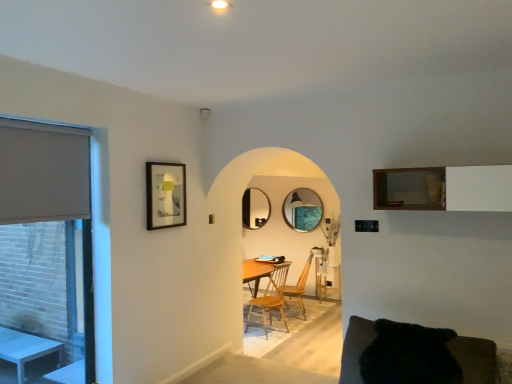
What do you see at coordinates (165, 195) in the screenshot?
I see `wooden framed artwork at upper left` at bounding box center [165, 195].

Based on the photo, measure the distance between matte glass mirror at center, which is the first mirror from front to back, and camera.

A distance of 6.65 meters exists between matte glass mirror at center, which is the first mirror from front to back, and camera.

What do you see at coordinates (255, 208) in the screenshot?
I see `matte black mirror at center, marked as the 1th mirror in a left-to-right arrangement` at bounding box center [255, 208].

This screenshot has height=384, width=512. Describe the element at coordinates (298, 287) in the screenshot. I see `wooden chair at center, the first chair positioned from the back` at that location.

Describe the element at coordinates (45, 252) in the screenshot. I see `beige fabric window at left` at that location.

The image size is (512, 384). I want to click on wooden frame at upper right, so click(444, 188).

Can you confirm if matte black mirror at center, arranged as the 2th mirror when viewed from the front, is positioned to the left of matte glass mirror at center, placed as the 2th mirror when sorted from back to front?

Yes, matte black mirror at center, arranged as the 2th mirror when viewed from the front, is to the left of matte glass mirror at center, placed as the 2th mirror when sorted from back to front.

Are matte black mirror at center, the second mirror when ordered from right to left, and matte glass mirror at center, placed as the 2th mirror when sorted from back to front, located far from each other?

matte black mirror at center, the second mirror when ordered from right to left, is near matte glass mirror at center, placed as the 2th mirror when sorted from back to front, not far away.

From the image's perspective, is matte black mirror at center, which ranks as the first mirror in back-to-front order, over matte glass mirror at center, marked as the 1th mirror in a right-to-left arrangement?

Indeed, from the image's perspective, matte black mirror at center, which ranks as the first mirror in back-to-front order, is shown above matte glass mirror at center, marked as the 1th mirror in a right-to-left arrangement.

In the scene shown: Choose the correct answer: Is matte black mirror at center, marked as the 1th mirror in a left-to-right arrangement, inside matte glass mirror at center, which is the first mirror from front to back, or outside it?

matte black mirror at center, marked as the 1th mirror in a left-to-right arrangement, is located beyond the bounds of matte glass mirror at center, which is the first mirror from front to back.

Does matte gray roller blind at left touch matte glass mirror at center, placed as the 2th mirror when sorted from back to front?

No, matte gray roller blind at left is not with matte glass mirror at center, placed as the 2th mirror when sorted from back to front.

Can you confirm if matte gray roller blind at left is thinner than matte glass mirror at center, which is the first mirror from front to back?

Indeed, matte gray roller blind at left has a lesser width compared to matte glass mirror at center, which is the first mirror from front to back.

Based on the photo, from the image's perspective, which object appears higher, matte gray roller blind at left or matte glass mirror at center, which is the first mirror from front to back?

matte gray roller blind at left is shown above in the image.

From the image's perspective, which is below, wooden framed artwork at upper left or wooden frame at upper right?

From the image's view, wooden framed artwork at upper left is below.

From a real-world perspective, does wooden framed artwork at upper left stand above wooden frame at upper right?

No.

Does point (153, 206) come closer to viewer compared to point (407, 178)?

No.

Is wooden framed artwork at upper left oriented towards wooden frame at upper right?

Yes, wooden framed artwork at upper left is aimed at wooden frame at upper right.

Is matte glass mirror at center, which is the first mirror from front to back, thinner than wooden chair at center, which is the 2th chair from front to back?

Yes, matte glass mirror at center, which is the first mirror from front to back, is thinner than wooden chair at center, which is the 2th chair from front to back.

How different are the orientations of matte glass mirror at center, placed as the 2th mirror when sorted from back to front, and wooden chair at center, the first chair positioned from the back, in degrees?

The facing directions of matte glass mirror at center, placed as the 2th mirror when sorted from back to front, and wooden chair at center, the first chair positioned from the back, are 63 degrees apart.

Between matte glass mirror at center, which ranks as the second mirror in left-to-right order, and wooden chair at center, which is the 2th chair from front to back, which one is positioned in front?

wooden chair at center, which is the 2th chair from front to back, is in front.

Is matte glass mirror at center, which is the first mirror from front to back, completely or partially outside of wooden chair at center, which is the 2th chair from front to back?

Indeed, matte glass mirror at center, which is the first mirror from front to back, is completely outside wooden chair at center, which is the 2th chair from front to back.

This screenshot has height=384, width=512. I want to click on window screen to the right of beige fabric window at left, so click(42, 172).

From their relative heights in the image, would you say beige fabric window at left is taller or shorter than matte gray roller blind at left?

Considering their sizes, beige fabric window at left has more height than matte gray roller blind at left.

Which object is further away from the camera taking this photo, beige fabric window at left or matte gray roller blind at left?

beige fabric window at left is further away from the camera.

In terms of size, does beige fabric window at left appear bigger or smaller than matte gray roller blind at left?

Considering their sizes, beige fabric window at left takes up more space than matte gray roller blind at left.

From the image's perspective, would you say matte gray roller blind at left is shown under wooden frame at upper right?

Actually, matte gray roller blind at left appears above wooden frame at upper right in the image.

Considering the positions of objects matte gray roller blind at left and wooden frame at upper right in the image provided, who is more to the right, matte gray roller blind at left or wooden frame at upper right?

wooden frame at upper right.

Who is shorter, matte gray roller blind at left or wooden frame at upper right?

With less height is wooden frame at upper right.

Are matte gray roller blind at left and wooden frame at upper right far apart?

Yes.

How distant is wooden framed artwork at upper left from matte glass mirror at center, placed as the 2th mirror when sorted from back to front?

wooden framed artwork at upper left is 3.39 meters from matte glass mirror at center, placed as the 2th mirror when sorted from back to front.

Does wooden framed artwork at upper left turn towards matte glass mirror at center, placed as the 2th mirror when sorted from back to front?

No.

Find the location of a particular element. mirror that is the 2nd object to the right of the wooden framed artwork at upper left, starting at the anchor is located at coordinates (302, 210).

How many degrees apart are the facing directions of wooden framed artwork at upper left and matte glass mirror at center, which is the first mirror from front to back?

91.8 degrees.

Locate an element on the screen. The width and height of the screenshot is (512, 384). mirror that is on the left side of matte glass mirror at center, marked as the 1th mirror in a right-to-left arrangement is located at coordinates (255, 208).

The width and height of the screenshot is (512, 384). In order to click on the 2nd mirror below the matte gray roller blind at left (from the image's perspective) in this screenshot , I will do [302, 210].

From the image, which object appears to be farther from black fuzzy couch at lower right, matte gray roller blind at left or wooden chair at center, positioned as the second chair in back-to-front order?

Among the two, wooden chair at center, positioned as the second chair in back-to-front order, is located further to black fuzzy couch at lower right.

Which object lies nearer to the anchor point wooden chair at center, the first chair positioned from the back, matte glass mirror at center, which ranks as the second mirror in left-to-right order, or wooden frame at upper right?

matte glass mirror at center, which ranks as the second mirror in left-to-right order, lies closer to wooden chair at center, the first chair positioned from the back, than the other object.

From the image, which object appears to be nearer to matte glass mirror at center, which is the first mirror from front to back, wooden frame at upper right or black fuzzy couch at lower right?

wooden frame at upper right lies closer to matte glass mirror at center, which is the first mirror from front to back, than the other object.

From the image, which object appears to be nearer to wooden chair at center, placed as the first chair when sorted from front to back, beige fabric window at left or matte gray roller blind at left?

beige fabric window at left.

Considering their positions, is wooden chair at center, placed as the first chair when sorted from front to back, positioned further to matte glass mirror at center, placed as the 2th mirror when sorted from back to front, than wooden frame at upper right?

wooden frame at upper right is further to matte glass mirror at center, placed as the 2th mirror when sorted from back to front.

Looking at the image, which one is located further to matte gray roller blind at left, wooden chair at center, the first chair positioned from the back, or beige fabric window at left?

wooden chair at center, the first chair positioned from the back, lies further to matte gray roller blind at left than the other object.

Estimate the real-world distances between objects in this image. Which object is further from wooden framed artwork at upper left, matte black mirror at center, the second mirror when ordered from right to left, or black fuzzy couch at lower right?

The object further to wooden framed artwork at upper left is matte black mirror at center, the second mirror when ordered from right to left.

Looking at the image, which one is located closer to wooden chair at center, positioned as the second chair in back-to-front order, matte black mirror at center, marked as the 1th mirror in a left-to-right arrangement, or black fuzzy couch at lower right?

matte black mirror at center, marked as the 1th mirror in a left-to-right arrangement, is closer to wooden chair at center, positioned as the second chair in back-to-front order.

What are the coordinates of `picture frame between matte gray roller blind at left and black fuzzy couch at lower right in the horizontal direction` in the screenshot? It's located at (165, 195).

This screenshot has height=384, width=512. I want to click on picture frame between wooden frame at upper right and matte glass mirror at center, placed as the 2th mirror when sorted from back to front, from front to back, so click(x=165, y=195).

Image resolution: width=512 pixels, height=384 pixels. What are the coordinates of `window screen located between wooden frame at upper right and wooden chair at center, placed as the first chair when sorted from front to back, in the depth direction` in the screenshot? It's located at (42, 172).

Image resolution: width=512 pixels, height=384 pixels. Find the location of `window between wooden frame at upper right and wooden chair at center, placed as the first chair when sorted from front to back, from front to back`. window between wooden frame at upper right and wooden chair at center, placed as the first chair when sorted from front to back, from front to back is located at coordinates (45, 252).